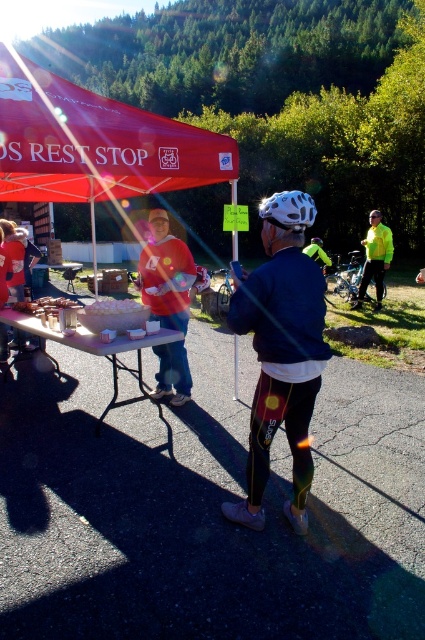
What is the exact coordinate of the matte black helmet at center?

The matte black helmet at center is located at coordinate point (x=280, y=352).

You are a cyclist at the rest stop and need to grab your white paper bag at center. You are currently standing next to the white plastic picnic table at center. In which direction should you move to reach your bag?

The white paper bag at center is to the right of the white plastic picnic table at center, so you should move to your right to reach it.

You are a cyclist at the rest stop and need to store your white matte bicycle helmet at center and your white paper bag at center. There is a storage box here that can only accommodate items up to 30 cm in height. Can both items fit inside the box?

The white matte bicycle helmet at center is much taller than the white paper bag at center. Since the storage box has a height limit of 30 cm, only the shorter item, the white paper bag at center, can fit. The helmet may exceed the height restriction and cannot be stored here.